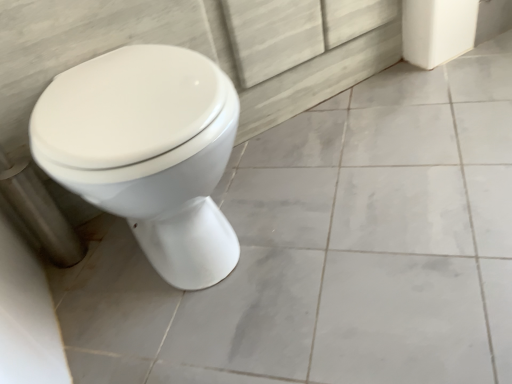
This screenshot has height=384, width=512. I want to click on free space in front of white glossy toilet at left, so click(x=246, y=344).